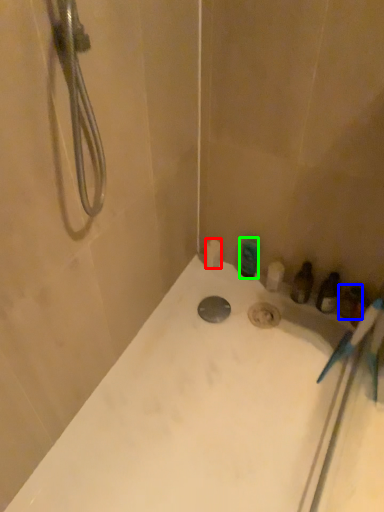
Question: Which object is the closest to the toilet paper (highlighted by a red box)? Choose among these: toiletry (highlighted by a blue box) or toiletry (highlighted by a green box).

Choices:
 (A) toiletry
 (B) toiletry

Answer: (B)